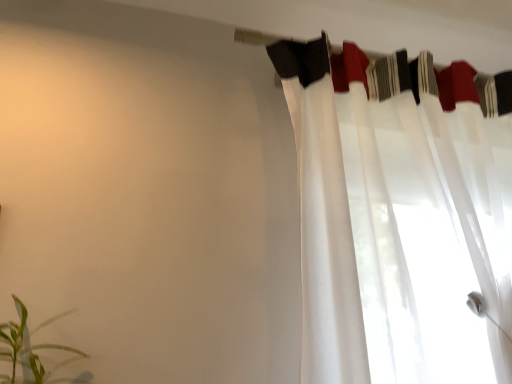
Question: In the image, is white sheer fabric at upper center on the left side or the right side of green leafy plant at lower left?

Choices:
 (A) left
 (B) right

Answer: (B)

Question: Does point pyautogui.click(x=500, y=110) appear closer or farther from the camera than point pyautogui.click(x=45, y=321)?

Choices:
 (A) closer
 (B) farther

Answer: (B)

Question: Considering the real-world distances, which object is closest to the green leafy plant at lower left?

Choices:
 (A) white sheer curtain at upper right
 (B) white sheer fabric at upper center

Answer: (A)

Question: Estimate the real-world distances between objects in this image. Which object is farther from the white sheer curtain at upper right?

Choices:
 (A) white sheer fabric at upper center
 (B) green leafy plant at lower left

Answer: (B)